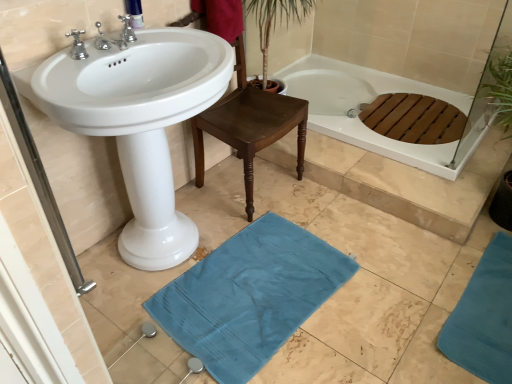
Locate an element on the screen. The height and width of the screenshot is (384, 512). free space to the left of polished chrome faucet at upper center, which ranks as the first tap in back-to-front order is located at coordinates [108, 45].